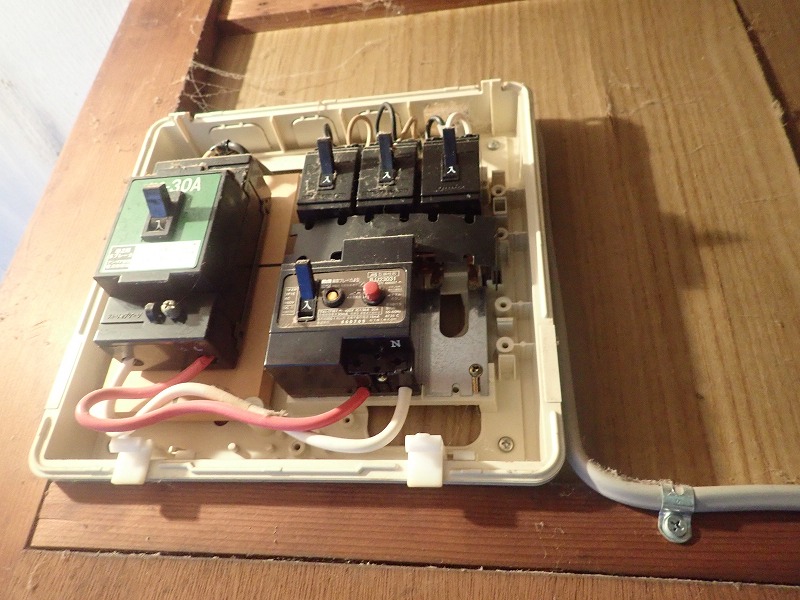
Identify the location of cobwebs. The height and width of the screenshot is (600, 800). (234, 94).